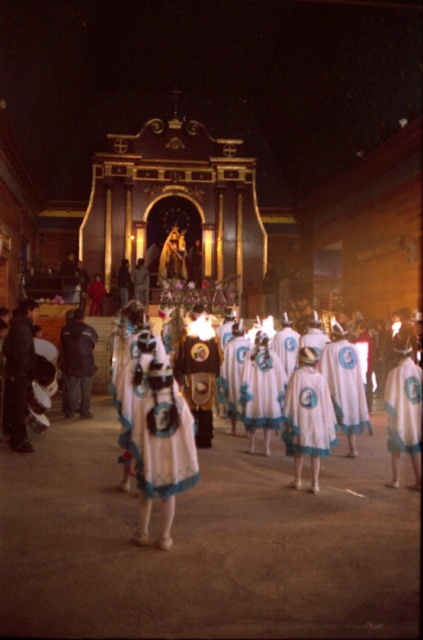
Who is lower down, white fabric dress at center or white cotton dress at center?

Positioned lower is white fabric dress at center.

In the scene shown: Is the position of white fabric dress at center more distant than that of white cotton dress at center?

No, it is in front of white cotton dress at center.

Find the location of `white fabric dress at center`. white fabric dress at center is located at coordinates (162, 436).